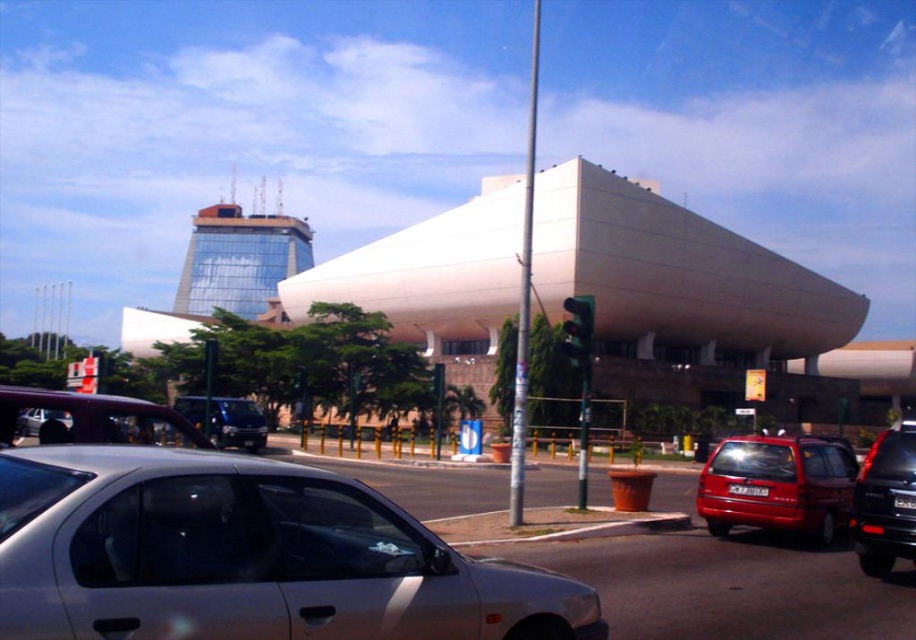
You are a pedestrian standing at the crosswalk near the green glass traffic light at center. You want to cross the street to reach the modern architectural structure in the background. Is the black glossy suv at lower right blocking your path?

Answer: The black glossy suv at lower right is to the right of green glass traffic light at center, so it is positioned to the right side of the pedestrian at the crosswalk. Since the pedestrian wants to go towards the modern architectural structure in the background, the suv is not directly blocking the path unless the pedestrian needs to move further right. However, based on the description, the suv is to the right of the traffic light, so it might not be in the direct path to the structure unless the path curves

You are standing at the camera position and want to take a photo of the black glossy suv at lower right. Is the suv within the camera frame?

The black glossy suv at lower right and camera are 28.29 feet apart from each other. The camera can capture objects up to 30 feet away, so the suv is within the camera frame.

You are standing at point A at point (x=912, y=445). You need to walk to point B, which is 9.05 meters away. Is there a direct path between them without any obstacles?

Yes, there is a direct path between point A at point (x=912, y=445) and point B, which is 9.05 meters away, as there are no obstacles mentioned in the scene description.